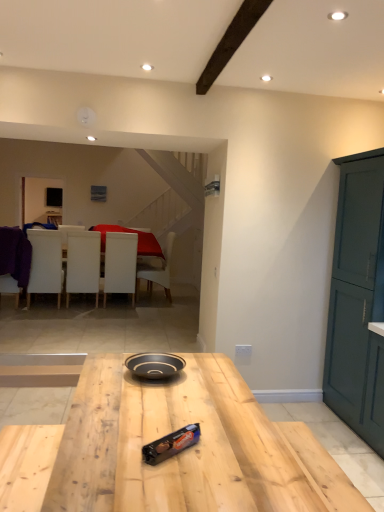
Where is `free space to the left of shiny chocolate bar at center`? The width and height of the screenshot is (384, 512). free space to the left of shiny chocolate bar at center is located at coordinates (123, 449).